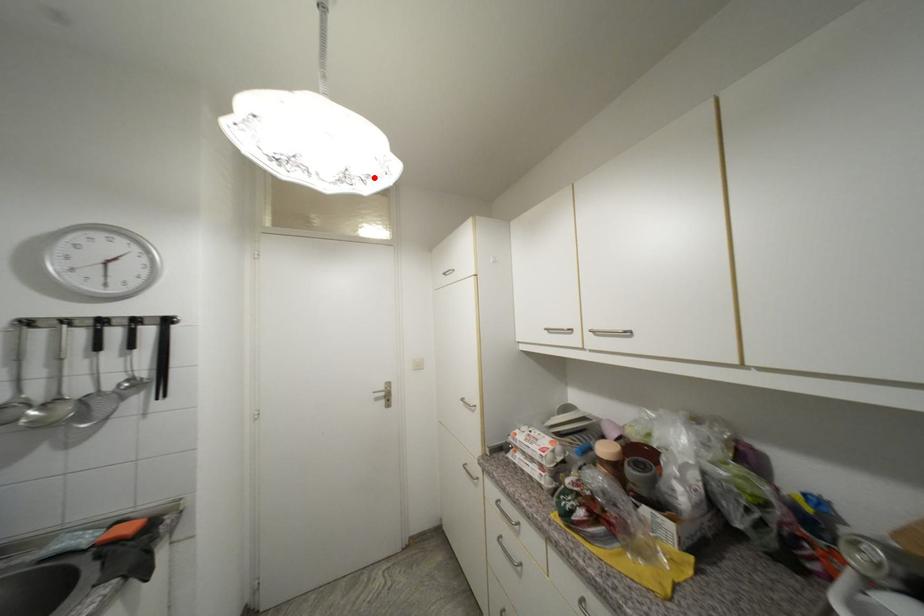
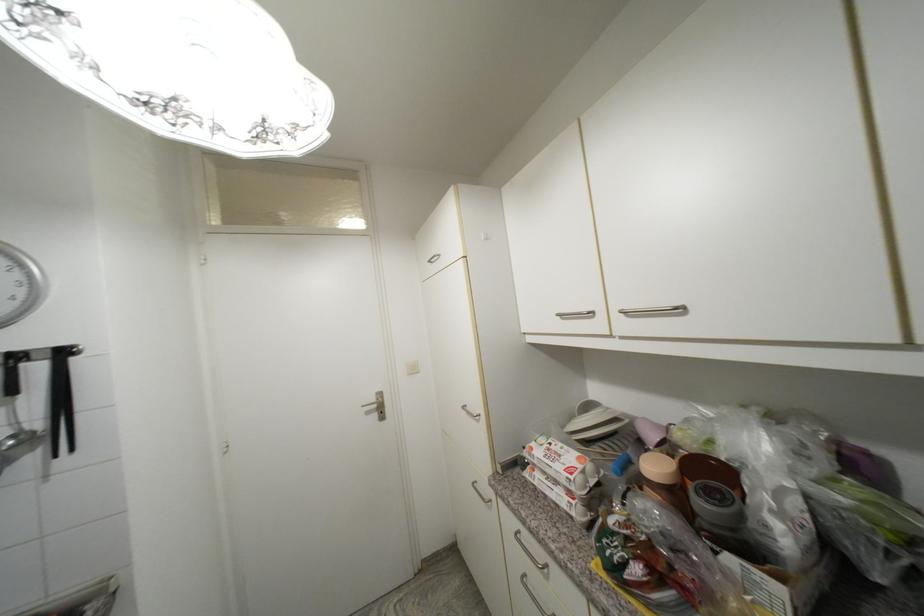
Question: I am providing you with two images of the same scene from different viewpoints. A red point is shown in image1. For the corresponding object point in image2, is it positioned nearer or farther from the camera?

Choices:
 (A) Nearer
 (B) Farther

Answer: (A)